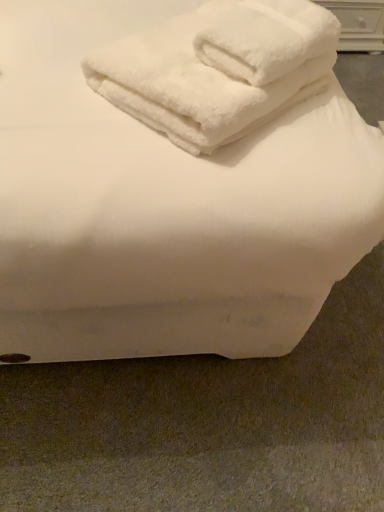
Question: Is white wood drawer at upper right taller or shorter than white fluffy towels at upper center?

Choices:
 (A) short
 (B) tall

Answer: (B)

Question: Considering the positions of point (347, 32) and point (205, 14), is point (347, 32) closer or farther from the camera than point (205, 14)?

Choices:
 (A) closer
 (B) farther

Answer: (B)

Question: Based on their positions, is white wood drawer at upper right located to the left or right of white fluffy towels at upper center?

Choices:
 (A) left
 (B) right

Answer: (B)

Question: In terms of width, does white fluffy towels at upper center look wider or thinner when compared to white wood drawer at upper right?

Choices:
 (A) wide
 (B) thin

Answer: (A)

Question: From a real-world perspective, relative to white wood drawer at upper right, is white fluffy towels at upper center vertically above or below?

Choices:
 (A) above
 (B) below

Answer: (A)

Question: Would you say white fluffy towels at upper center is to the left or to the right of white wood drawer at upper right in the picture?

Choices:
 (A) left
 (B) right

Answer: (A)

Question: Considering the positions of point (231, 30) and point (382, 11), is point (231, 30) closer or farther from the camera than point (382, 11)?

Choices:
 (A) farther
 (B) closer

Answer: (B)